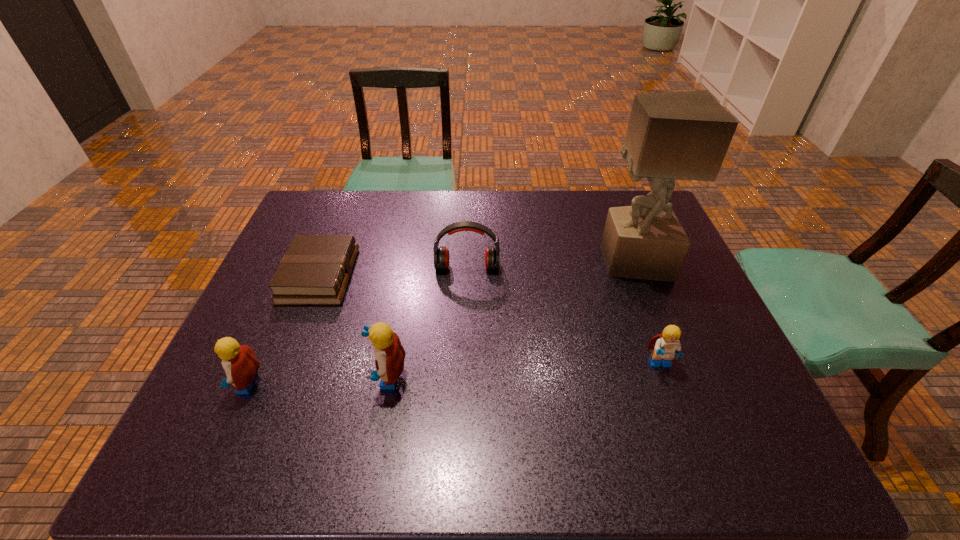
Where is `the leftmost Lego`? the leftmost Lego is located at coordinates (240, 364).

Where is `the fourth object from right to left`? This screenshot has height=540, width=960. the fourth object from right to left is located at coordinates (389, 354).

Identify the location of the second shortest object. This screenshot has height=540, width=960. (666, 345).

Find the location of a particular element. The image size is (960, 540). the shortest Lego is located at coordinates (666, 345).

This screenshot has width=960, height=540. What are the coordinates of `earphone` in the screenshot? It's located at (441, 255).

Locate an element on the screen. sculpture is located at coordinates (685, 135).

Where is `Bible`? Image resolution: width=960 pixels, height=540 pixels. Bible is located at coordinates (315, 270).

Find the location of a particular element. The image size is (960, 540). vacant space located 0.100m on the front-facing side of the second Lego from right to left is located at coordinates (323, 377).

Locate an element on the screen. The width and height of the screenshot is (960, 540). vacant space located 0.270m on the front-facing side of the second Lego from right to left is located at coordinates (249, 377).

Image resolution: width=960 pixels, height=540 pixels. What are the coordinates of `free space located 0.190m on the front-facing side of the second Lego from right to left` in the screenshot? It's located at (283, 377).